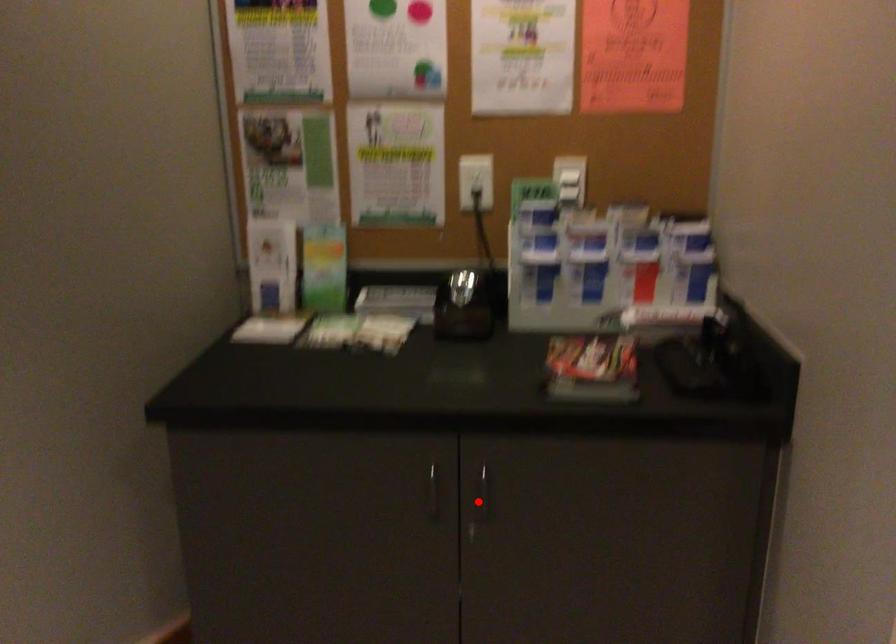
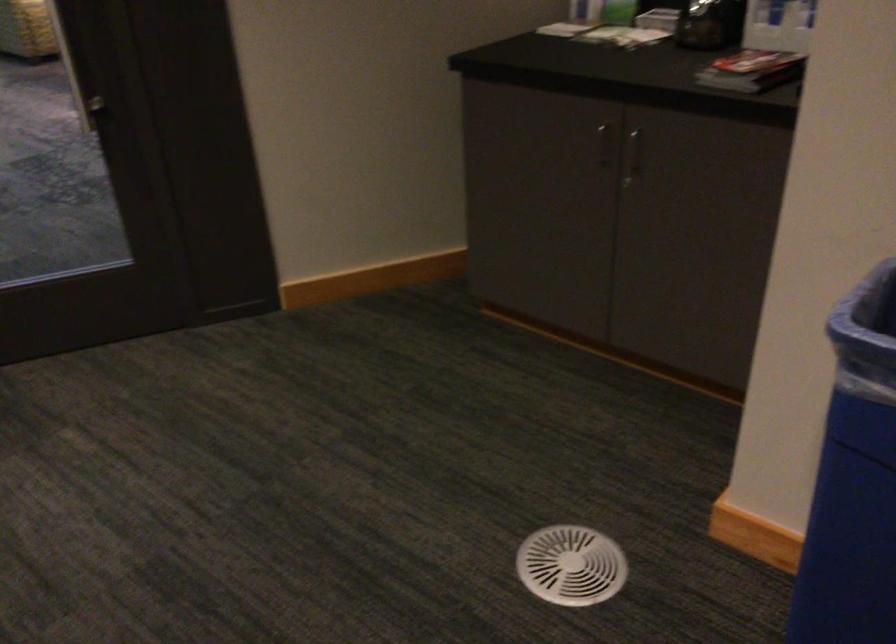
Question: I am providing you with two images of the same scene from different viewpoints. A red point is shown in image1. For the corresponding object point in image2, is it positioned nearer or farther from the camera?

Choices:
 (A) Nearer
 (B) Farther

Answer: (B)